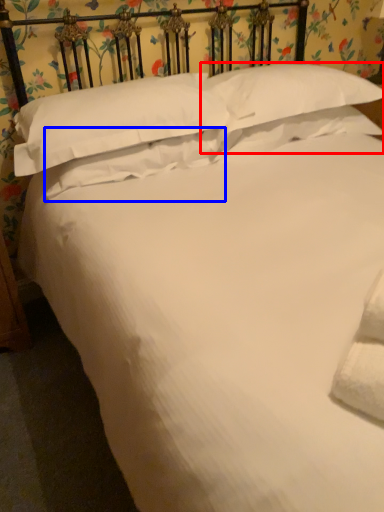
Question: Which object appears closest to the camera in this image, pillow (highlighted by a red box) or pillow (highlighted by a blue box)?

Choices:
 (A) pillow
 (B) pillow

Answer: (B)